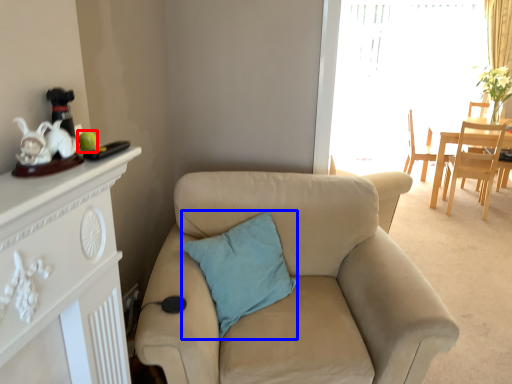
Question: Which point is closer to the camera, teal (highlighted by a red box) or pillow (highlighted by a blue box)?

Choices:
 (A) teal
 (B) pillow

Answer: (A)